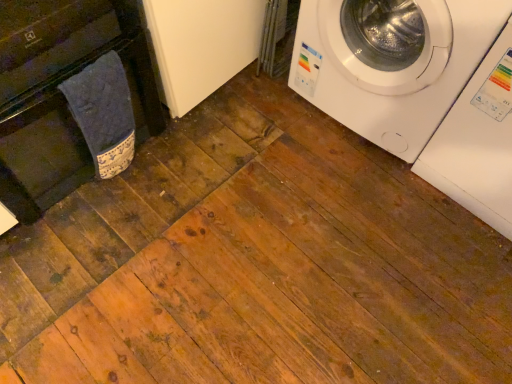
Identify the location of free location to the right of blue fabric towel at left. The image size is (512, 384). (165, 170).